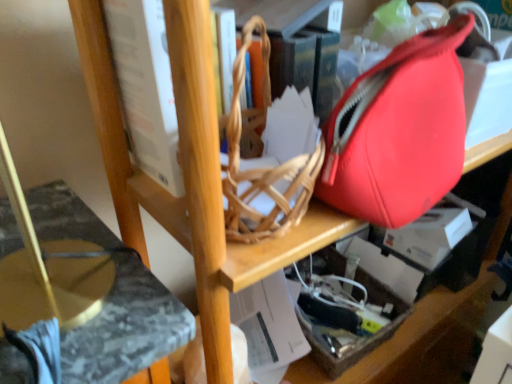
This screenshot has height=384, width=512. What do you see at coordinates (146, 87) in the screenshot?
I see `white paperboard book at upper center` at bounding box center [146, 87].

At what (x,y) coordinates should I click in order to perform the action: click on marble-patterned swivel chair at lower left. Please return your answer as a coordinate pair (x, y). Image resolution: width=512 pixels, height=384 pixels. Looking at the image, I should click on (126, 328).

This screenshot has height=384, width=512. Describe the element at coordinates (399, 131) in the screenshot. I see `matte red tote bag at right` at that location.

Identify the location of white paperboard book at upper center. The image size is (512, 384). (146, 87).

Is white paperboard book at upper center facing towards translucent plastic box at lower right?

No, white paperboard book at upper center is not oriented towards translucent plastic box at lower right.

What are the coordinates of `box that appears below the white paperboard book at upper center (from a real-world perspective)` in the screenshot? It's located at (353, 332).

Which object is thinner, white paperboard book at upper center or translucent plastic box at lower right?

white paperboard book at upper center.

Considering the relative sizes of matte red tote bag at right and white paperboard book at upper center in the image provided, is matte red tote bag at right bigger than white paperboard book at upper center?

Incorrect, matte red tote bag at right is not larger than white paperboard book at upper center.

Is matte red tote bag at right wider than white paperboard book at upper center?

Incorrect, the width of matte red tote bag at right does not surpass that of white paperboard book at upper center.

Are matte red tote bag at right and white paperboard book at upper center far apart?

Actually, matte red tote bag at right and white paperboard book at upper center are a little close together.

Is the depth of marble-patterned swivel chair at lower left greater than that of matte red tote bag at right?

No, it is not.

Is marble-patterned swivel chair at lower left aimed at matte red tote bag at right?

No.

Does marble-patterned swivel chair at lower left have a larger size compared to matte red tote bag at right?

Indeed, marble-patterned swivel chair at lower left has a larger size compared to matte red tote bag at right.

Considering the relative sizes of marble-patterned swivel chair at lower left and matte red tote bag at right in the image provided, is marble-patterned swivel chair at lower left taller than matte red tote bag at right?

Indeed, marble-patterned swivel chair at lower left has a greater height compared to matte red tote bag at right.

Is white paperboard book at upper center not near matte red tote bag at right?

No, there isn't a large distance between white paperboard book at upper center and matte red tote bag at right.

Which object is more forward, white paperboard book at upper center or matte red tote bag at right?

matte red tote bag at right is closer to the camera.

From a real-world perspective, which object stands above the other?

In real-world perspective, white paperboard book at upper center is above.

Is white paperboard book at upper center to the right of matte red tote bag at right from the viewer's perspective?

No.

Does translucent plastic box at lower right turn towards white paperboard book at upper center?

No, translucent plastic box at lower right is not oriented towards white paperboard book at upper center.

Is point (359, 266) closer or farther from the camera than point (143, 122)?

Clearly, point (359, 266) is more distant from the camera than point (143, 122).

From the image's perspective, between translucent plastic box at lower right and white paperboard book at upper center, who is located below?

translucent plastic box at lower right appears lower in the image.

Between translucent plastic box at lower right and white paperboard book at upper center, which one appears on the right side from the viewer's perspective?

Positioned to the right is translucent plastic box at lower right.

You are a GUI agent. You are given a task and a screenshot of the screen. Output one action in this format:
    pyautogui.click(x=<x>, y=<y>)
    Task: Click on the swivel chair directly beneath the white paperboard book at upper center (from a real-world perspective)
    
    Given the screenshot: What is the action you would take?
    pyautogui.click(x=126, y=328)

How far apart are marble-patterned swivel chair at lower left and white paperboard book at upper center?

marble-patterned swivel chair at lower left and white paperboard book at upper center are 6.20 inches apart.

Does marble-patterned swivel chair at lower left have a smaller size compared to white paperboard book at upper center?

Incorrect, marble-patterned swivel chair at lower left is not smaller in size than white paperboard book at upper center.

Can you tell me how much marble-patterned swivel chair at lower left and white paperboard book at upper center differ in facing direction?

1.72 degrees.

Is the depth of matte red tote bag at right less than that of translucent plastic box at lower right?

Yes, matte red tote bag at right is closer to the viewer.

Does point (446, 178) come behind point (305, 280)?

No.

Is matte red tote bag at right wider or thinner than translucent plastic box at lower right?

Clearly, matte red tote bag at right has less width compared to translucent plastic box at lower right.

Between matte red tote bag at right and translucent plastic box at lower right, which one has smaller size?

Smaller between the two is translucent plastic box at lower right.

Locate an element on the screen. Image resolution: width=512 pixels, height=384 pixels. book to the left of translucent plastic box at lower right is located at coordinates (146, 87).

Find the location of a particular element. Image resolution: width=512 pixels, height=384 pixels. tote bag below the white paperboard book at upper center (from the image's perspective) is located at coordinates (399, 131).

Estimate the real-world distances between objects in this image. Which object is further from translucent plastic box at lower right, white paperboard book at upper center or matte red tote bag at right?

white paperboard book at upper center.

Estimate the real-world distances between objects in this image. Which object is further from white paperboard book at upper center, marble-patterned swivel chair at lower left or matte red tote bag at right?

matte red tote bag at right.

When comparing their distances from white paperboard book at upper center, does marble-patterned swivel chair at lower left or translucent plastic box at lower right seem closer?

The object closer to white paperboard book at upper center is marble-patterned swivel chair at lower left.

Estimate the real-world distances between objects in this image. Which object is closer to marble-patterned swivel chair at lower left, matte red tote bag at right or translucent plastic box at lower right?

matte red tote bag at right.

Considering their positions, is matte red tote bag at right positioned closer to white paperboard book at upper center than translucent plastic box at lower right?

Based on the image, matte red tote bag at right appears to be nearer to white paperboard book at upper center.

When comparing their distances from translucent plastic box at lower right, does marble-patterned swivel chair at lower left or white paperboard book at upper center seem further?

Based on the image, white paperboard book at upper center appears to be further to translucent plastic box at lower right.

Estimate the real-world distances between objects in this image. Which object is closer to translucent plastic box at lower right, matte red tote bag at right or marble-patterned swivel chair at lower left?

matte red tote bag at right lies closer to translucent plastic box at lower right than the other object.

When comparing their distances from matte red tote bag at right, does marble-patterned swivel chair at lower left or white paperboard book at upper center seem closer?

white paperboard book at upper center lies closer to matte red tote bag at right than the other object.

What are the coordinates of `book between marble-patterned swivel chair at lower left and translucent plastic box at lower right along the z-axis` in the screenshot? It's located at (146, 87).

Where is `tote bag between marble-patterned swivel chair at lower left and translucent plastic box at lower right in the front-back direction`? The image size is (512, 384). tote bag between marble-patterned swivel chair at lower left and translucent plastic box at lower right in the front-back direction is located at coordinates (399, 131).

At what (x,y) coordinates should I click in order to perform the action: click on tote bag between white paperboard book at upper center and translucent plastic box at lower right vertically. Please return your answer as a coordinate pair (x, y). Looking at the image, I should click on (399, 131).

The height and width of the screenshot is (384, 512). I want to click on book situated between marble-patterned swivel chair at lower left and matte red tote bag at right from left to right, so [146, 87].